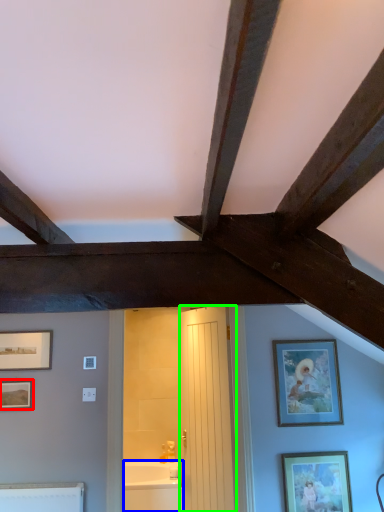
Question: Considering the real-world distances, which object is closest to picture frame (highlighted by a red box)? bathtub (highlighted by a blue box) or door (highlighted by a green box).

Choices:
 (A) bathtub
 (B) door

Answer: (B)